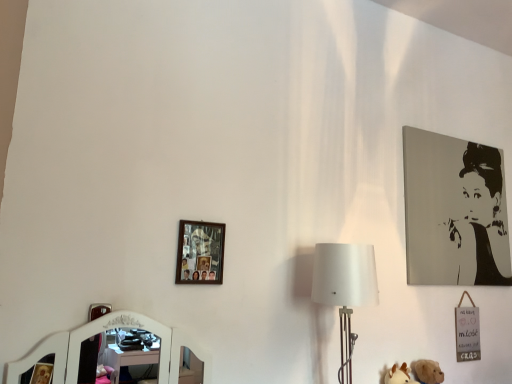
What do you see at coordinates (454, 212) in the screenshot? The height and width of the screenshot is (384, 512). I see `black and white portrait at upper right, which is the 2th picture frame in front-to-back order` at bounding box center [454, 212].

This screenshot has width=512, height=384. Describe the element at coordinates (345, 289) in the screenshot. I see `white fabric lampshade at center-right` at that location.

Where is `black and white portrait at upper right, positioned as the 1th picture frame in back-to-front order`? The height and width of the screenshot is (384, 512). black and white portrait at upper right, positioned as the 1th picture frame in back-to-front order is located at coordinates (454, 212).

From the image's perspective, is black and white portrait at upper right, which is the 2th picture frame in front-to-back order, located beneath white fabric lampshade at center-right?

Incorrect, from the image's perspective, black and white portrait at upper right, which is the 2th picture frame in front-to-back order, is higher than white fabric lampshade at center-right.

Based on the photo, which point is more distant from viewer, (497, 263) or (356, 266)?

Point (497, 263)

Is black and white portrait at upper right, which is the 2th picture frame in front-to-back order, positioned beyond the bounds of white fabric lampshade at center-right?

Indeed, black and white portrait at upper right, which is the 2th picture frame in front-to-back order, is completely outside white fabric lampshade at center-right.

Is black and white portrait at upper right, which is the 2th picture frame in front-to-back order, far away from white fabric lampshade at center-right?

They are positioned close to each other.

Where is `the 1st picture frame directly above the white fabric lampshade at center-right (from a real-world perspective)`? The height and width of the screenshot is (384, 512). the 1st picture frame directly above the white fabric lampshade at center-right (from a real-world perspective) is located at coordinates (200, 252).

Is white fabric lampshade at center-right bigger than wooden photo frame at upper left, which is the second picture frame in back-to-front order?

Yes.

Is point (371, 248) closer or farther from the camera than point (202, 281)?

Point (371, 248) is positioned farther from the camera compared to point (202, 281).

Which is correct: white fabric lampshade at center-right is inside wooden photo frame at upper left, the 2th picture frame in the right-to-left sequence, or outside of it?

white fabric lampshade at center-right is not inside wooden photo frame at upper left, the 2th picture frame in the right-to-left sequence, it's outside.

From a real-world perspective, which object stands above the other?

In real-world perspective, black and white portrait at upper right, positioned as the 1th picture frame in back-to-front order, is above.

From the image's perspective, is wooden photo frame at upper left, the 2th picture frame in the right-to-left sequence, over black and white portrait at upper right, which is the 2th picture frame in front-to-back order?

No, from the image's perspective, wooden photo frame at upper left, the 2th picture frame in the right-to-left sequence, is not on top of black and white portrait at upper right, which is the 2th picture frame in front-to-back order.

Is point (197, 239) more distant than point (473, 248)?

That is False.

Can you confirm if black and white portrait at upper right, the second picture frame in the left-to-right sequence, is smaller than wooden photo frame at upper left, the 2th picture frame in the right-to-left sequence?

Incorrect, black and white portrait at upper right, the second picture frame in the left-to-right sequence, is not smaller in size than wooden photo frame at upper left, the 2th picture frame in the right-to-left sequence.

In the scene shown: From the image's perspective, which one is positioned higher, black and white portrait at upper right, the second picture frame in the left-to-right sequence, or wooden photo frame at upper left, arranged as the first picture frame when viewed from the left?

black and white portrait at upper right, the second picture frame in the left-to-right sequence.

Does point (483, 250) come behind point (220, 252)?

Yes.

Between white fabric lampshade at center-right and black and white portrait at upper right, positioned as the 1th picture frame in back-to-front order, which one appears on the left side from the viewer's perspective?

white fabric lampshade at center-right.

Does white fabric lampshade at center-right have a greater width compared to black and white portrait at upper right, the second picture frame in the left-to-right sequence?

Correct, the width of white fabric lampshade at center-right exceeds that of black and white portrait at upper right, the second picture frame in the left-to-right sequence.

Which is farther from the camera, (342, 334) or (467, 246)?

The point (467, 246) is farther from the camera.

Can you confirm if wooden photo frame at upper left, which is the second picture frame in back-to-front order, is shorter than white fabric lampshade at center-right?

Yes, wooden photo frame at upper left, which is the second picture frame in back-to-front order, is shorter than white fabric lampshade at center-right.

Between wooden photo frame at upper left, the 1th picture frame in the front-to-back sequence, and white fabric lampshade at center-right, which one is positioned behind?

wooden photo frame at upper left, the 1th picture frame in the front-to-back sequence, is further from the camera.

From a real-world perspective, is wooden photo frame at upper left, which is the second picture frame in back-to-front order, positioned above or below white fabric lampshade at center-right?

From a real-world perspective, wooden photo frame at upper left, which is the second picture frame in back-to-front order, is physically above white fabric lampshade at center-right.

In terms of width, does wooden photo frame at upper left, the 2th picture frame in the right-to-left sequence, look wider or thinner when compared to white fabric lampshade at center-right?

In the image, wooden photo frame at upper left, the 2th picture frame in the right-to-left sequence, appears to be more narrow than white fabric lampshade at center-right.

From a real-world perspective, count 2nd picture frames upward from the white fabric lampshade at center-right and point to it. Please provide its 2D coordinates.

[(454, 212)]

I want to click on table lamp below the wooden photo frame at upper left, which is the second picture frame in back-to-front order (from the image's perspective), so click(345, 289).

From the image, which object appears to be farther from black and white portrait at upper right, positioned as the 1th picture frame in back-to-front order, white fabric lampshade at center-right or wooden photo frame at upper left, the 1th picture frame in the front-to-back sequence?

The object further to black and white portrait at upper right, positioned as the 1th picture frame in back-to-front order, is wooden photo frame at upper left, the 1th picture frame in the front-to-back sequence.

Estimate the real-world distances between objects in this image. Which object is closer to white fabric lampshade at center-right, black and white portrait at upper right, which is the 2th picture frame in front-to-back order, or wooden photo frame at upper left, arranged as the first picture frame when viewed from the left?

wooden photo frame at upper left, arranged as the first picture frame when viewed from the left.

Estimate the real-world distances between objects in this image. Which object is closer to wooden photo frame at upper left, arranged as the first picture frame when viewed from the left, black and white portrait at upper right, positioned as the 1th picture frame in back-to-front order, or white fabric lampshade at center-right?

Based on the image, white fabric lampshade at center-right appears to be nearer to wooden photo frame at upper left, arranged as the first picture frame when viewed from the left.

From the picture: Considering their positions, is wooden photo frame at upper left, the 1th picture frame in the front-to-back sequence, positioned closer to white fabric lampshade at center-right than black and white portrait at upper right, which is the 2th picture frame in front-to-back order?

wooden photo frame at upper left, the 1th picture frame in the front-to-back sequence.

From the image, which object appears to be nearer to wooden photo frame at upper left, which is the second picture frame in back-to-front order, white fabric lampshade at center-right or black and white portrait at upper right, the second picture frame in the left-to-right sequence?

white fabric lampshade at center-right.

From the image, which object appears to be nearer to black and white portrait at upper right, which is the 2th picture frame in front-to-back order, wooden photo frame at upper left, the 1th picture frame in the front-to-back sequence, or white fabric lampshade at center-right?

white fabric lampshade at center-right lies closer to black and white portrait at upper right, which is the 2th picture frame in front-to-back order, than the other object.

This screenshot has height=384, width=512. What are the coordinates of `table lamp located between wooden photo frame at upper left, arranged as the first picture frame when viewed from the left, and black and white portrait at upper right, positioned as the 1th picture frame in back-to-front order, in the left-right direction` in the screenshot? It's located at (345, 289).